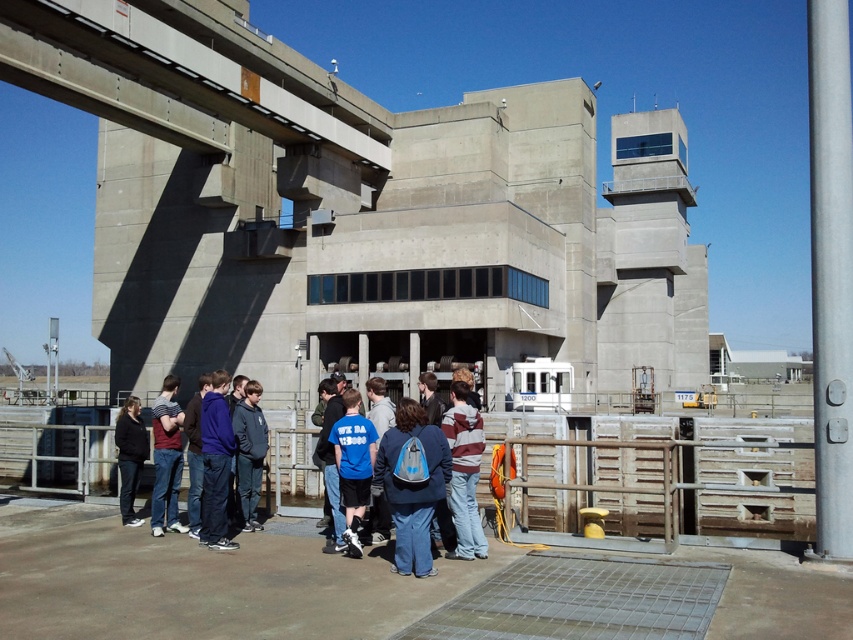
You are standing at the entrance of the lock facility and notice two points marked in the scene. Which of the two points, point (387, 493) or point (171, 436), is closer to you?

Point (387, 493) is closer to the viewer than point (171, 436).

In the scene shown: You are a photographer trying to capture a photo of the lock facility. You notice a blue fabric backpack at center and dark blue jeans at lower left in your frame. To ensure both items are visible without overlapping, which object should you move closer to the camera?

You should move the dark blue jeans at lower left closer to the camera because the blue fabric backpack at center is to the right of it, so moving the jeans forward would prevent overlap while keeping both in frame.